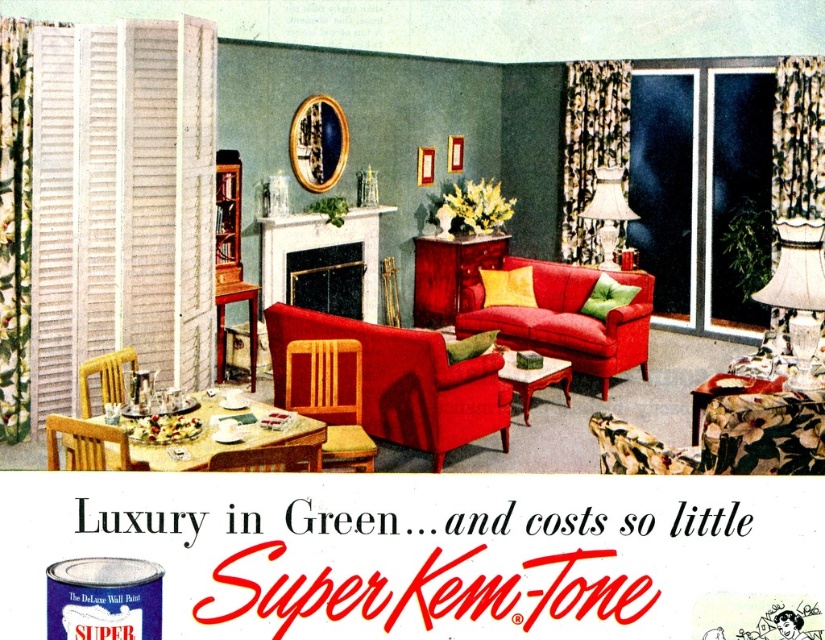
The width and height of the screenshot is (825, 640). What do you see at coordinates (430, 554) in the screenshot? I see `metallic blue paint can at center` at bounding box center [430, 554].

What are the coordinates of `metallic blue paint can at center` in the screenshot? It's located at (430, 554).

Find the location of `metallic blue paint can at center`. metallic blue paint can at center is located at coordinates (430, 554).

Looking at this image, is velvet red couch at center bigger than white marble fireplace at center?

No.

Based on the photo, can you confirm if velvet red couch at center is shorter than white marble fireplace at center?

Yes, velvet red couch at center is shorter than white marble fireplace at center.

Is point (496, 372) farther from camera compared to point (347, 310)?

No, (496, 372) is in front of (347, 310).

Where is `velvet red couch at center`? The width and height of the screenshot is (825, 640). velvet red couch at center is located at coordinates (404, 381).

Can you confirm if white wood shutter at left is bigger than wooden chair at center?

Indeed, white wood shutter at left has a larger size compared to wooden chair at center.

Does white wood shutter at left appear under wooden chair at center?

No.

Between point (144, 147) and point (366, 465), which one is positioned behind?

The point (144, 147) is more distant.

Image resolution: width=825 pixels, height=640 pixels. Find the location of `white wood shutter at left`. white wood shutter at left is located at coordinates (121, 202).